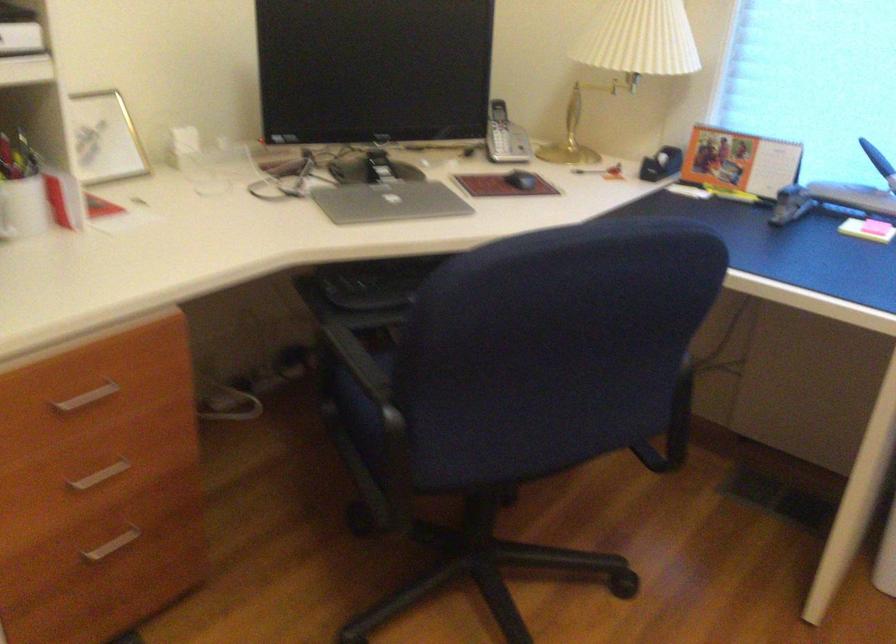
You are a GUI agent. You are given a task and a screenshot of the screen. Output one action in this format:
    pyautogui.click(x=<x>, y=<y>)
    Task: Click on the black chair armrest
    The height and width of the screenshot is (644, 896).
    Given the screenshot: What is the action you would take?
    pyautogui.click(x=365, y=375)